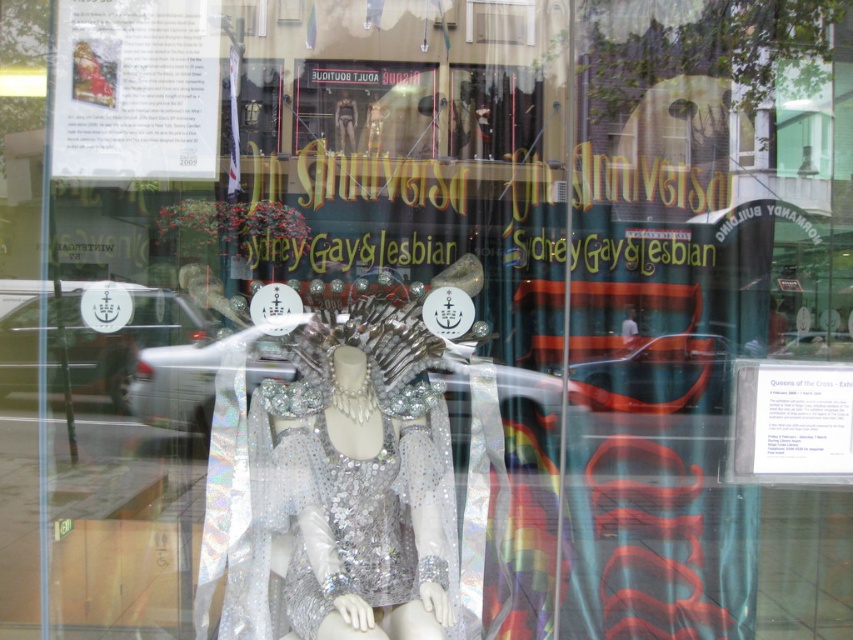
Question: Can you confirm if holographic sequined dress at center is thinner than sparkly silver dress at center?

Choices:
 (A) no
 (B) yes

Answer: (A)

Question: Does holographic sequined dress at center appear over sparkly silver dress at center?

Choices:
 (A) no
 (B) yes

Answer: (B)

Question: Can you confirm if holographic sequined dress at center is thinner than sparkly silver dress at center?

Choices:
 (A) no
 (B) yes

Answer: (A)

Question: Which point is closer to the camera?

Choices:
 (A) pos(392,504)
 (B) pos(341,561)

Answer: (B)

Question: Which point is closer to the camera?

Choices:
 (A) holographic sequined dress at center
 (B) sparkly silver dress at center

Answer: (B)